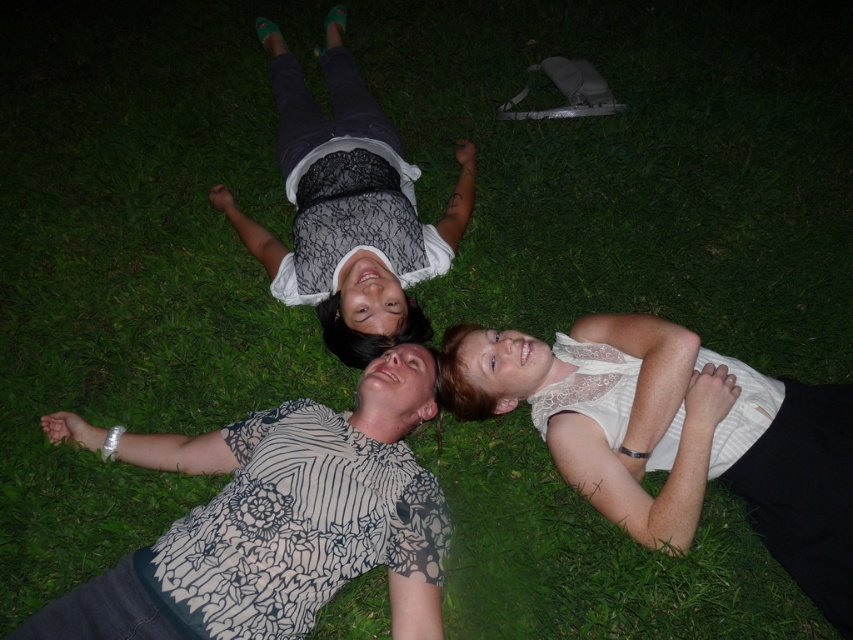
You are a photographer trying to capture a closeup of the white lace shirt at center and the white lace tank top at center. Which one should you zoom in on to ensure it appears larger in the photo?

The white lace tank top at center is taller than the white lace shirt at center, so zoom in on the white lace tank top at center to make it appear larger in the photo.

You are taking a photo of the three people lying on the grass. You want to focus on the person at point (360,397) and the person at point (374,116). Which of these two points is closer to the camera?

Point (360,397) is closer to the camera than point (374,116).

You are a photographer trying to capture a group photo of the people in the scene. You notice two clothing items that might be distracting in the final shot. The white lace tank top at center and the matte black shirt at upper center. Which clothing item is wider and might require adjusting its position to avoid being too prominent?

The white lace tank top at center is wider than the matte black shirt at upper center, so it might require adjusting its position to avoid being too prominent.